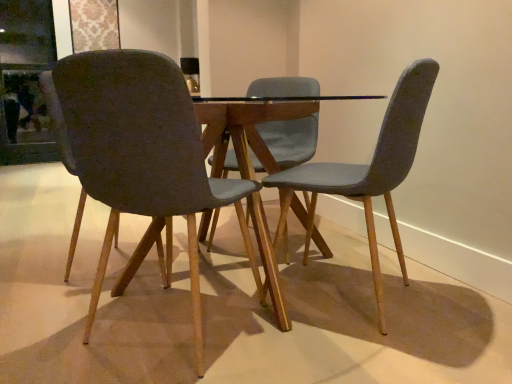
Where is `free space that is to the left of textured gray chair at left, which is the first chair from left to right`? free space that is to the left of textured gray chair at left, which is the first chair from left to right is located at coordinates (52, 324).